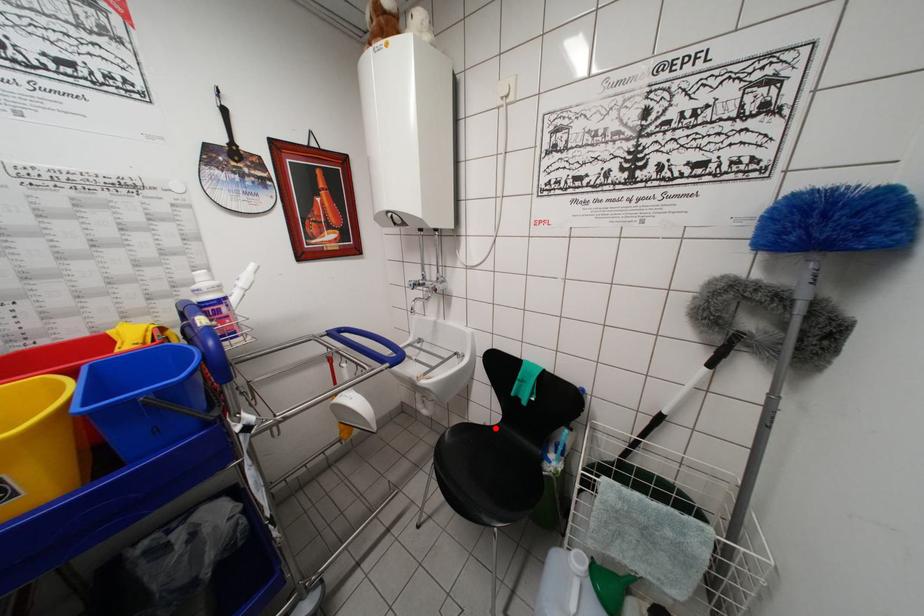
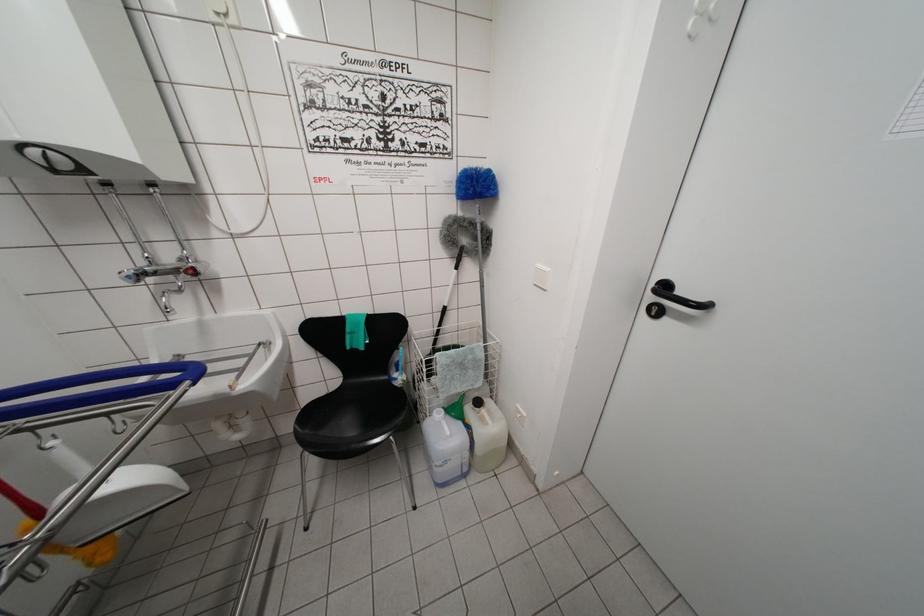
The point at the highlighted location is marked in the first image. Where is the corresponding point in the second image?

(335, 395)